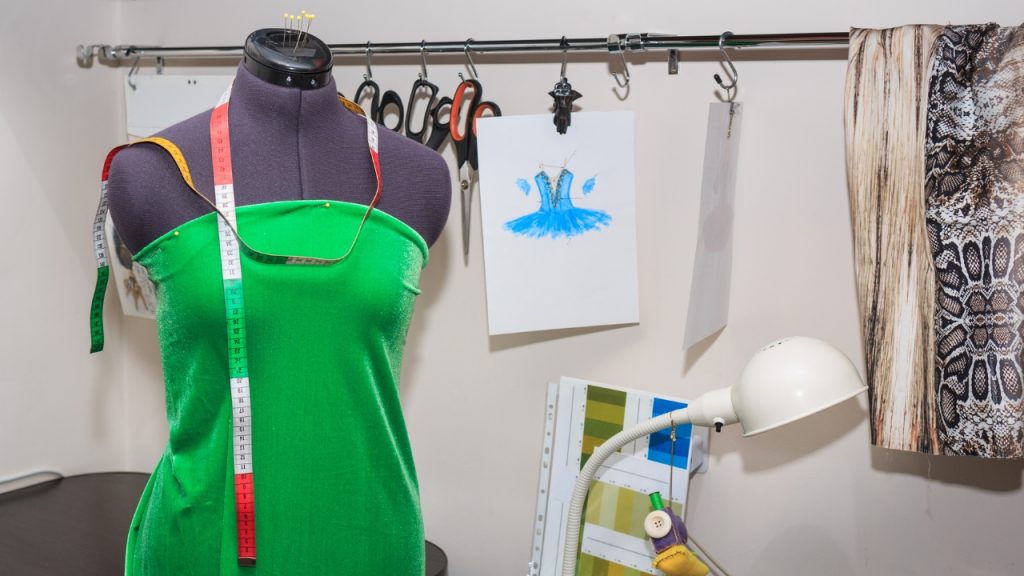
This screenshot has height=576, width=1024. I want to click on tubular shelf, so click(x=439, y=52).